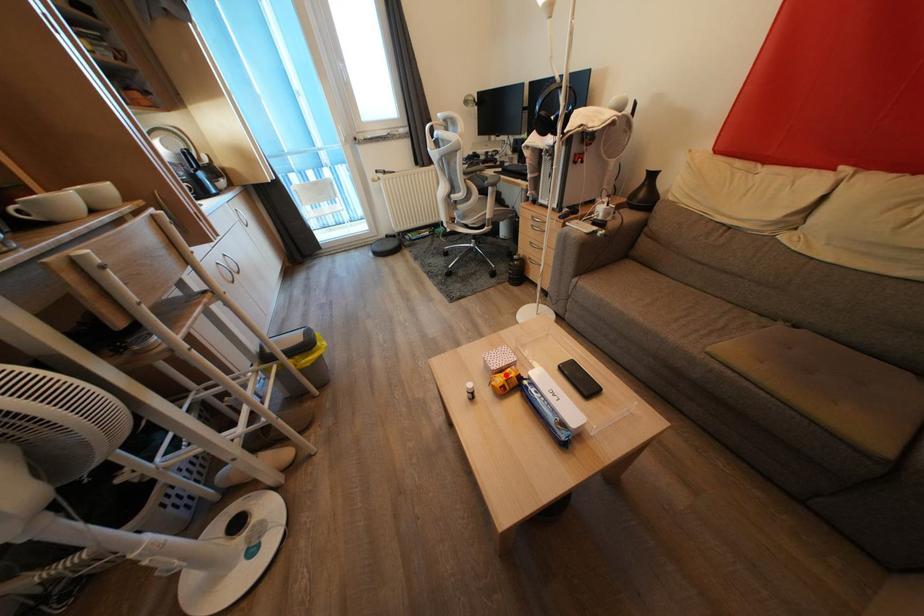
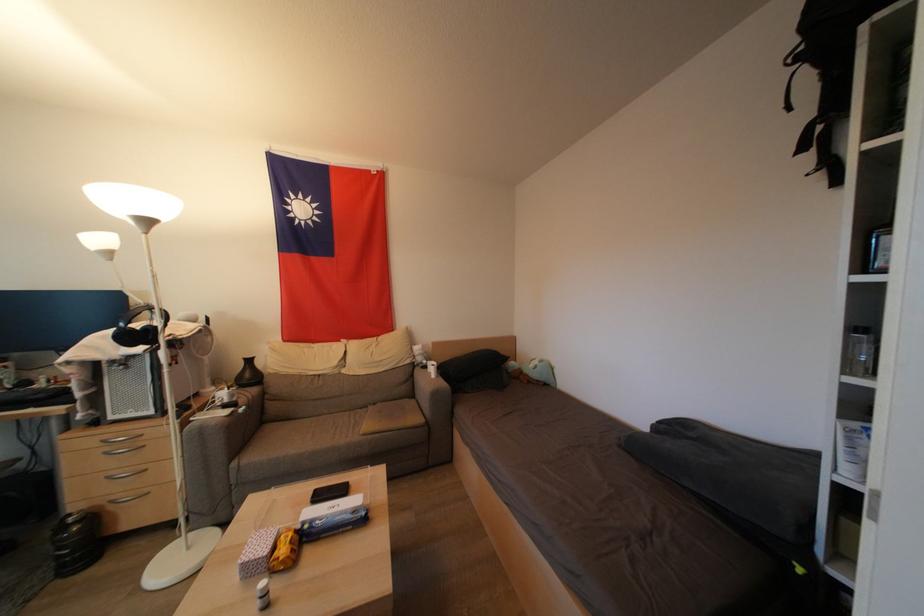
Locate, in the second image, the point that corresponds to the highlighted location in the first image.

(277, 553)